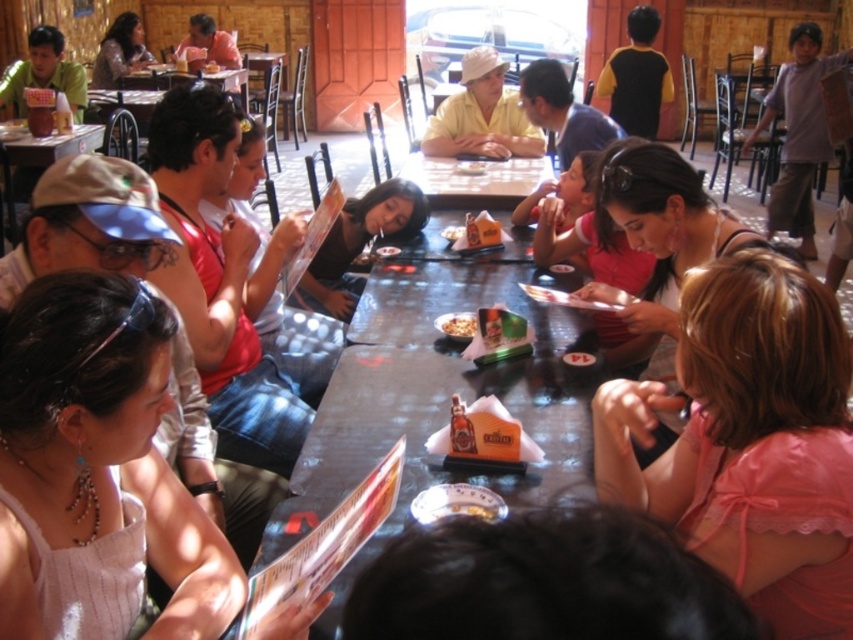
Question: From the image, what is the correct spatial relationship of yellow matte hat at center in relation to smooth brown bread at center?

Choices:
 (A) below
 (B) above

Answer: (A)

Question: Which is nearer to the matte red shirt at center?

Choices:
 (A) matte pink shirt at center
 (B) yellow matte hat at center
 (C) pink satin blouse at lower right

Answer: (A)

Question: Which point is farther to the camera?

Choices:
 (A) (412, 320)
 (B) (479, 198)
 (C) (460, 81)

Answer: (C)

Question: Which object is positioned closest to the wooden table at left?

Choices:
 (A) wooden table at center
 (B) matte red shirt at center

Answer: (A)

Question: Does matte black table at center appear over matte black menu at center?

Choices:
 (A) yes
 (B) no

Answer: (B)

Question: Does matte red shirt at center appear on the left side of smooth white bowl at center?

Choices:
 (A) no
 (B) yes

Answer: (B)